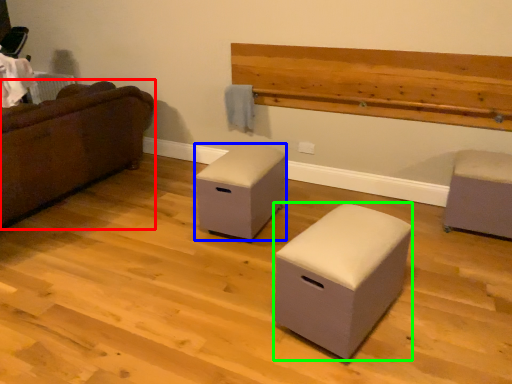
Question: Which is farther away from studio couch (highlighted by a red box)? furniture (highlighted by a blue box) or furniture (highlighted by a green box)?

Choices:
 (A) furniture
 (B) furniture

Answer: (B)